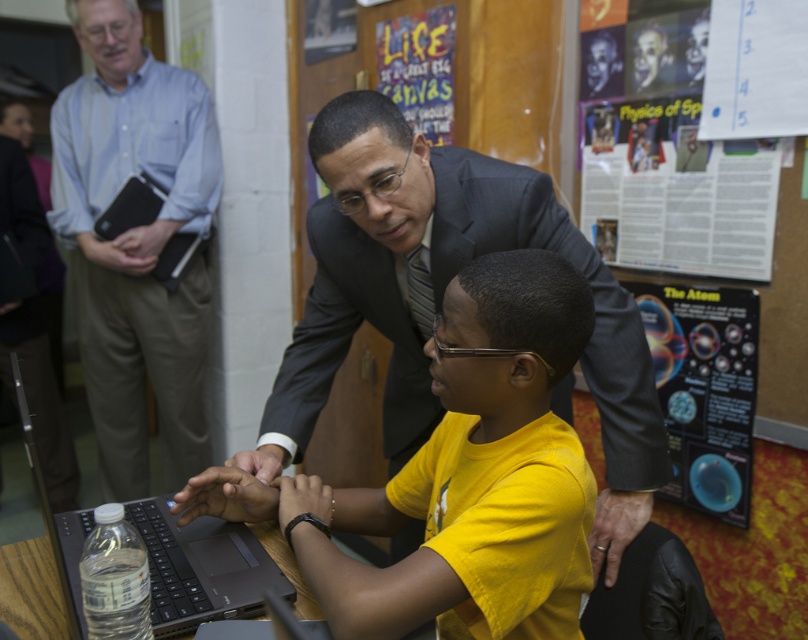
Question: Does black matte laptop at center have a lesser width compared to matte black hands at center?

Choices:
 (A) yes
 (B) no

Answer: (B)

Question: Which point is closer to the camera taking this photo?

Choices:
 (A) (27, 182)
 (B) (20, 568)
 (C) (745, 426)
 (D) (170, 557)

Answer: (D)

Question: Estimate the real-world distances between objects in this image. Which object is farther from the dark gray suit at center?

Choices:
 (A) matte canvas poster at upper center
 (B) matte black hand at center

Answer: (A)

Question: Which of these objects is positioned closest to the matte black hands at center?

Choices:
 (A) light blue shirt at upper left
 (B) dark gray leather hand at lower center
 (C) dark gray suit at center
 (D) matte black hand at center

Answer: (D)

Question: Does dark gray suit at left appear over wooden table at lower center?

Choices:
 (A) no
 (B) yes

Answer: (B)

Question: Is paper poster at upper right positioned before black rubber watch at lower center?

Choices:
 (A) no
 (B) yes

Answer: (A)